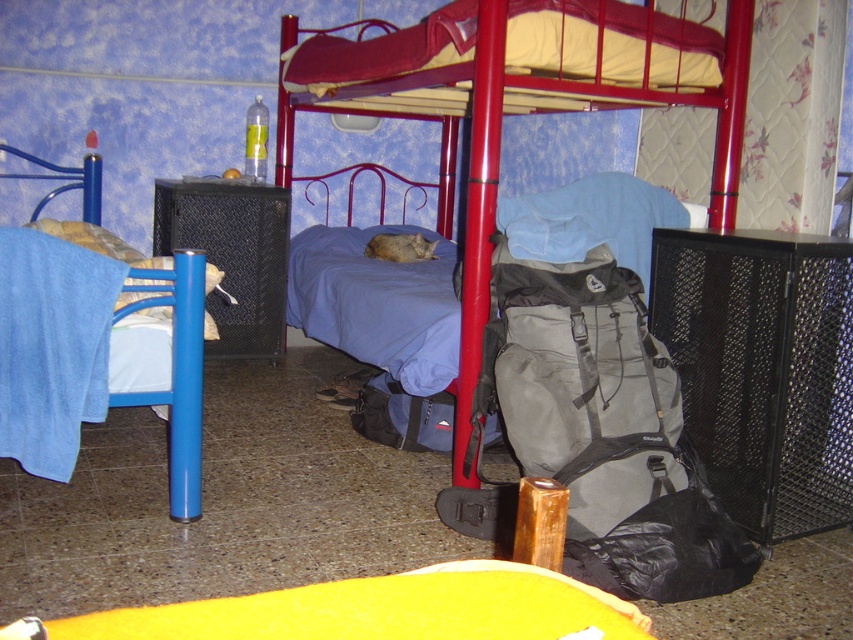
Who is shorter, metallic red bunk bed at center or blue fabric bed at left?

Standing shorter between the two is blue fabric bed at left.

Does metallic red bunk bed at center have a lesser width compared to blue fabric bed at left?

Incorrect, metallic red bunk bed at center's width is not less than blue fabric bed at left's.

Does point (463, 433) come behind point (183, 476)?

That is True.

Find the location of `metallic red bunk bed at center`. metallic red bunk bed at center is located at coordinates (503, 112).